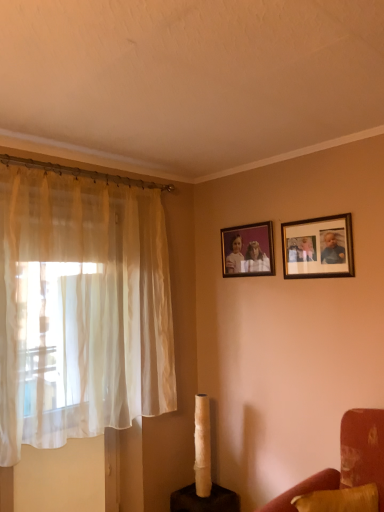
Question: Considering the positions of velvet red armchair at lower right and wooden photo frame at upper right, marked as the 1th picture frame in a front-to-back arrangement, in the image, is velvet red armchair at lower right taller or shorter than wooden photo frame at upper right, marked as the 1th picture frame in a front-to-back arrangement,?

Choices:
 (A) tall
 (B) short

Answer: (A)

Question: In the image, is velvet red armchair at lower right positioned in front of or behind wooden photo frame at upper right, which appears as the 1th picture frame when viewed from the right?

Choices:
 (A) behind
 (B) front

Answer: (B)

Question: Which of these objects is positioned closest to the sheer white curtain at left?

Choices:
 (A) velvet red couch at lower right
 (B) matte wooden picture frame at upper center, placed as the 1th picture frame when sorted from left to right
 (C) wooden photo frame at upper right, the second picture frame when ordered from left to right
 (D) velvet red armchair at lower right

Answer: (B)

Question: Which object is positioned closest to the matte wooden picture frame at upper center, which is counted as the second picture frame, starting from the right?

Choices:
 (A) sheer white curtain at left
 (B) wooden photo frame at upper right, which appears as the 1th picture frame when viewed from the right
 (C) velvet red armchair at lower right
 (D) velvet red couch at lower right

Answer: (B)